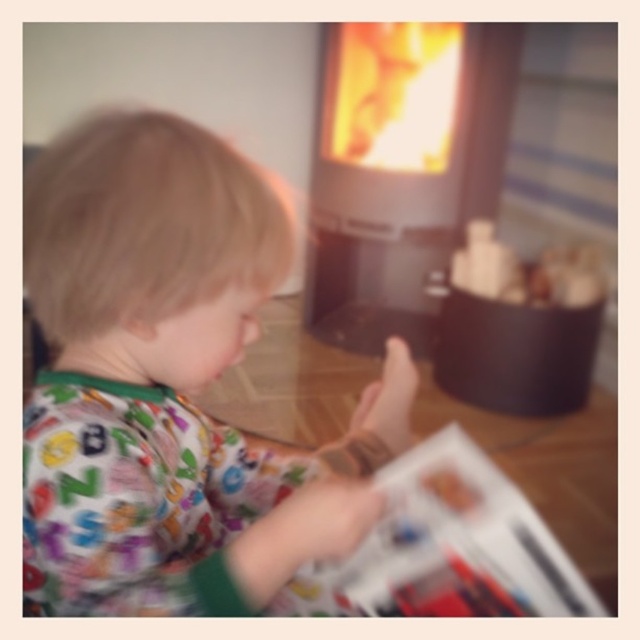
Measure the distance between printed fabric shirt at center and printed paper magazine at lower center.

7.02 inches

Can you confirm if printed fabric shirt at center is positioned below printed paper magazine at lower center?

No, printed fabric shirt at center is not below printed paper magazine at lower center.

Locate an element on the screen. The image size is (640, 640). printed fabric shirt at center is located at coordinates (172, 387).

Locate an element on the screen. Image resolution: width=640 pixels, height=640 pixels. matte black fireplace at center is located at coordinates (401, 170).

Who is positioned more to the left, matte black fireplace at center or printed paper magazine at lower center?

Positioned to the left is printed paper magazine at lower center.

Is point (406, 180) closer to viewer compared to point (464, 444)?

That is False.

In order to click on matte black fireplace at center in this screenshot , I will do `click(401, 170)`.

Does point (104, 198) come closer to viewer compared to point (406, 88)?

Yes, point (104, 198) is in front of point (406, 88).

Is point (248, 470) closer to camera compared to point (401, 224)?

Yes, point (248, 470) is closer to viewer.

Locate an element on the screen. printed fabric shirt at center is located at coordinates pos(172,387).